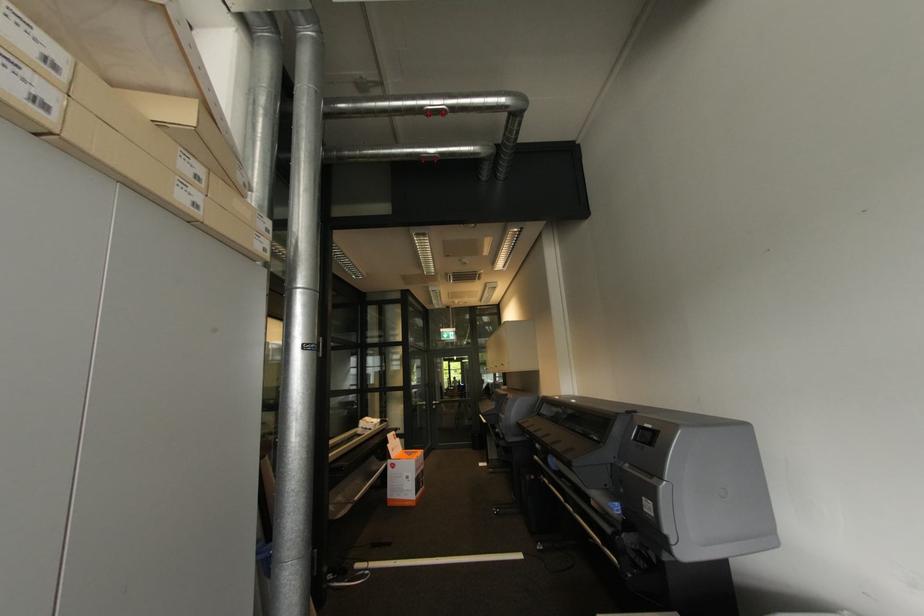
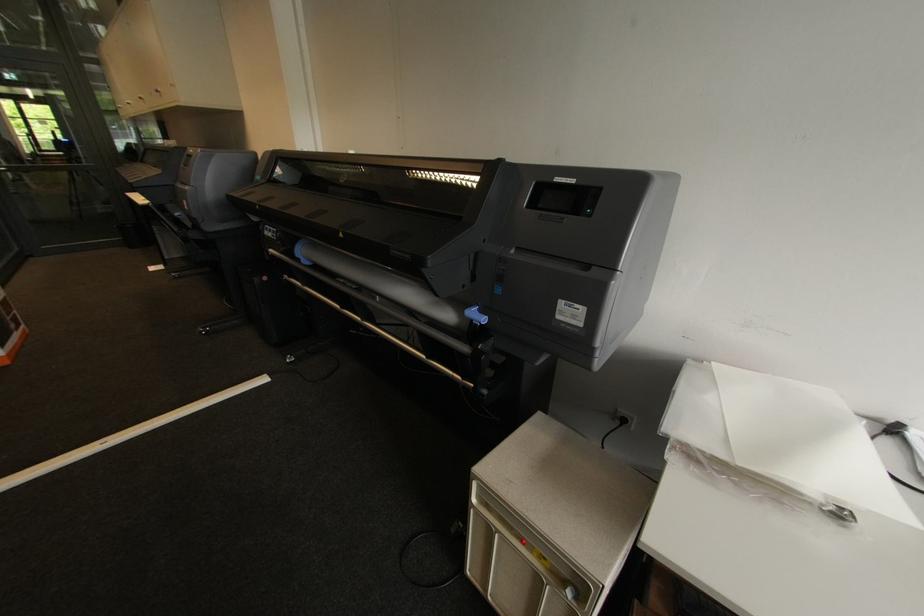
In the second image, find the point that corresponds to point (649, 511) in the first image.

(563, 318)